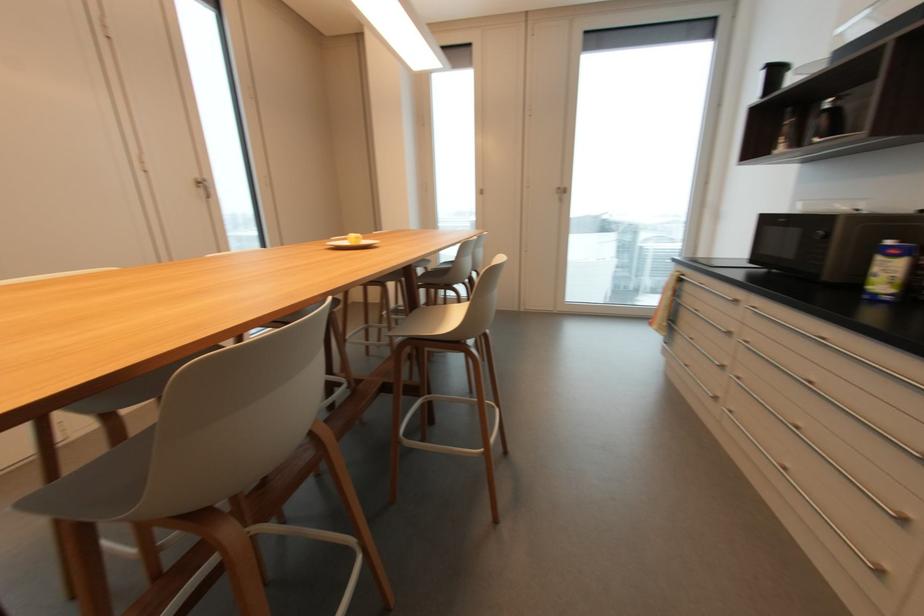
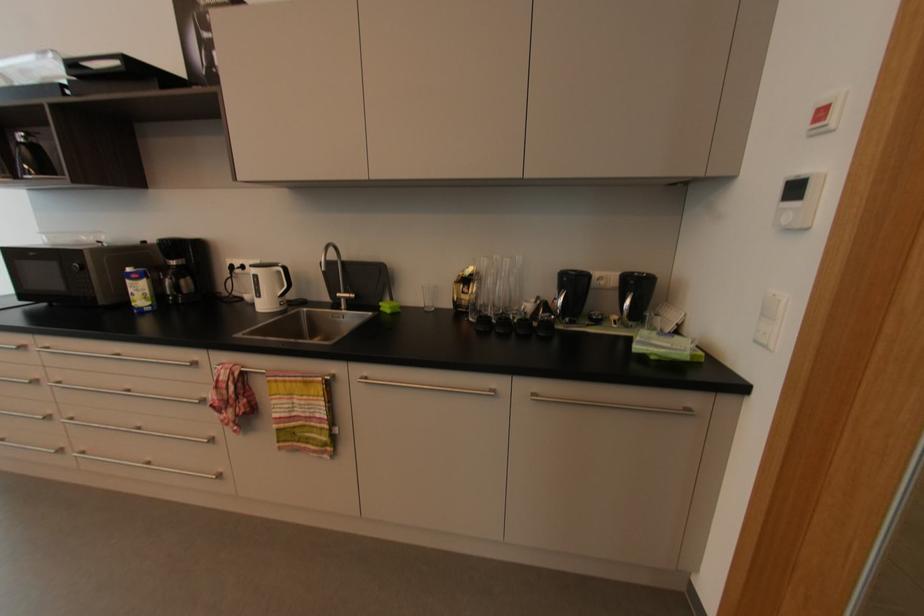
First-person continuous shooting, in which direction is the camera rotating?

The camera rotated toward right-down.